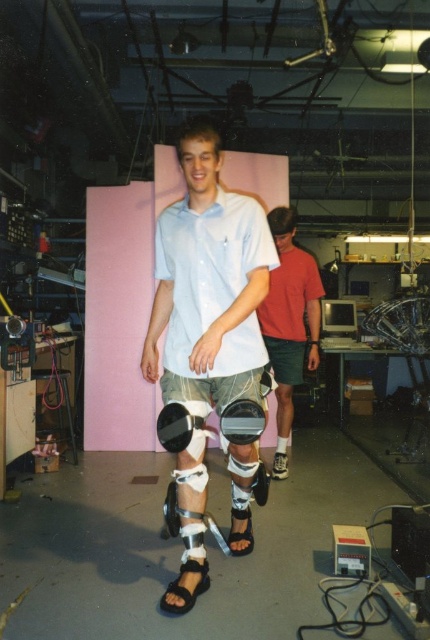
You are a physical therapist observing a patient in a lab. You notice the matte white shirt at center and the black matte knee pad at center. Which object is positioned more to the left?

The black matte knee pad at center is positioned more to the left because the matte white shirt at center is to the right of it.

You are standing at point (168, 259) in a lab. You need to take a photo of the entire setup. Is the camera 2.50 meters away from you enough to capture everything in the frame?

The camera is 2.50 meters away from you at point (168, 259). This distance may be sufficient to capture the entire lab setup in one frame, depending on the camera lens and field of view. However, without specific information about the camera equipment, it is difficult to confirm definitively.

Based on the photo, you are standing at the origin of the coordinate system in the laboratory. There are two points marked in the room. The first point is at coordinates point [196,426] and the second point is at point [252,408]. If you want to move towards the point that is further away from you, which coordinate should you head towards?

Point [196,426] is behind point [252,408], so you should head towards point [196,426] as it is further away from your current position at the origin.